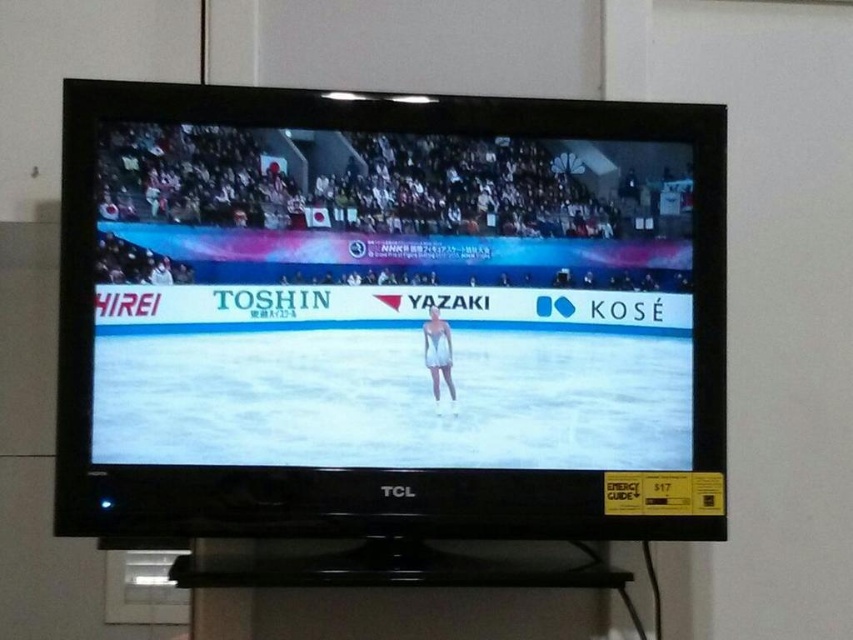
Question: Observing the image, what is the correct spatial positioning of matte white figure skater at center in reference to white matte swimsuit at center?

Choices:
 (A) right
 (B) left

Answer: (B)

Question: Is matte white figure skater at center closer to the viewer compared to white matte swimsuit at center?

Choices:
 (A) no
 (B) yes

Answer: (B)

Question: Does matte white figure skater at center appear on the left side of white matte swimsuit at center?

Choices:
 (A) yes
 (B) no

Answer: (A)

Question: Which of the following is the closest to the observer?

Choices:
 (A) matte white figure skater at center
 (B) white matte swimsuit at center

Answer: (A)

Question: Which object is farther from the camera taking this photo?

Choices:
 (A) white matte swimsuit at center
 (B) matte white figure skater at center

Answer: (A)